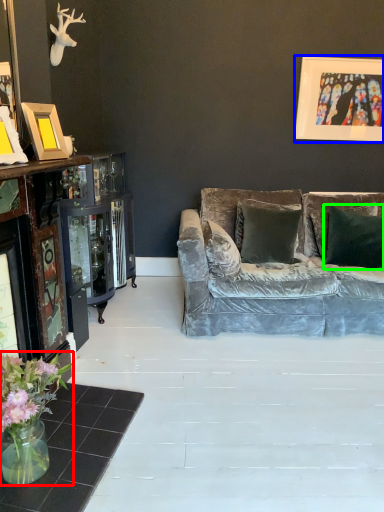
Question: Which object is positioned closest to floral arrangement (highlighted by a red box)? Select from picture frame (highlighted by a blue box) and pillow (highlighted by a green box).

Choices:
 (A) picture frame
 (B) pillow

Answer: (B)